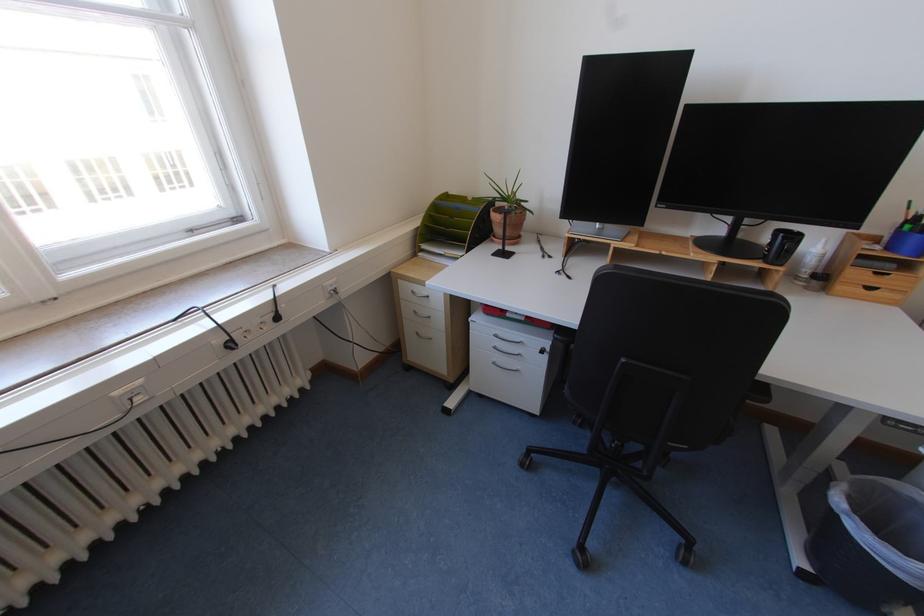
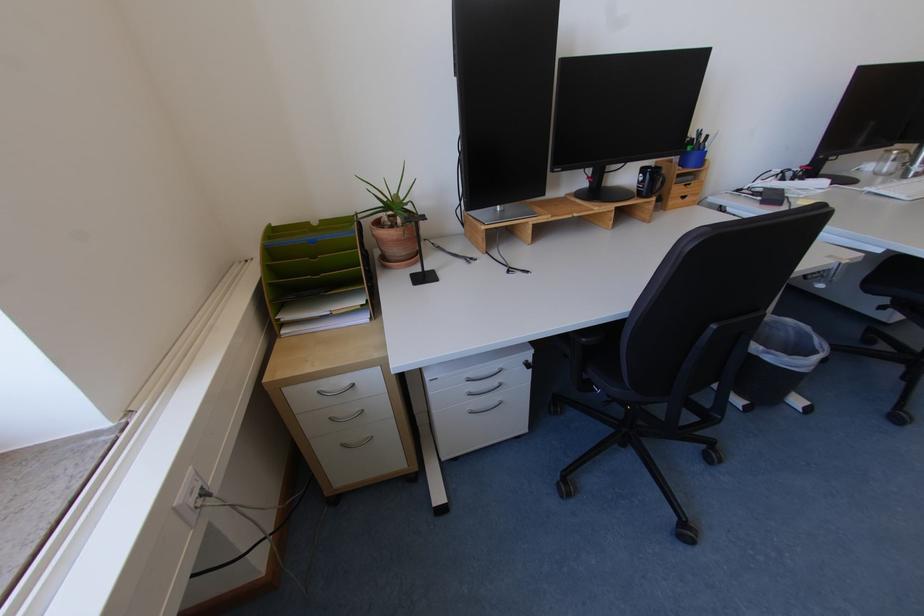
Locate, in the second image, the point that corresponds to [504,347] in the first image.

(477, 392)